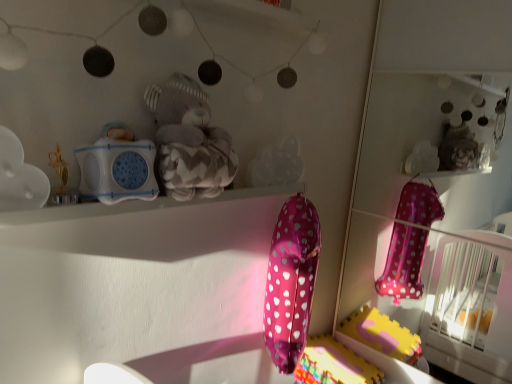
Question: From the image's perspective, is gray plush teddy bear at upper center, acting as the third toy starting from the left, below white matte cloud at upper left, which is counted as the 4th toy, starting from the right?

Choices:
 (A) no
 (B) yes

Answer: (A)

Question: Is gray plush teddy bear at upper center, acting as the third toy starting from the left, outside of white matte cloud at upper left, the 1th toy from the left?

Choices:
 (A) no
 (B) yes

Answer: (B)

Question: Can you confirm if gray plush teddy bear at upper center, acting as the third toy starting from the left, is shorter than white matte cloud at upper left, which is counted as the 4th toy, starting from the right?

Choices:
 (A) no
 (B) yes

Answer: (A)

Question: Is gray plush teddy bear at upper center, acting as the third toy starting from the left, at the left side of white matte cloud at upper left, the 1th toy from the left?

Choices:
 (A) yes
 (B) no

Answer: (B)

Question: Can you confirm if gray plush teddy bear at upper center, acting as the third toy starting from the left, is wider than white matte cloud at upper left, the 1th toy from the left?

Choices:
 (A) no
 (B) yes

Answer: (B)

Question: Considering the positions of point (272, 329) and point (309, 369), is point (272, 329) closer or farther from the camera than point (309, 369)?

Choices:
 (A) farther
 (B) closer

Answer: (B)

Question: From the image's perspective, is pink metallic balloon at center located above or below pink polka dot balloon at lower center?

Choices:
 (A) below
 (B) above

Answer: (B)

Question: From a real-world perspective, is pink metallic balloon at center above or below pink polka dot balloon at lower center?

Choices:
 (A) below
 (B) above

Answer: (B)

Question: In terms of size, does pink metallic balloon at center appear bigger or smaller than pink polka dot balloon at lower center?

Choices:
 (A) small
 (B) big

Answer: (A)

Question: From the image's perspective, relative to pink metallic balloon at center, is translucent plastic cloud at center, which is the fourth toy in left-to-right order, above or below?

Choices:
 (A) above
 (B) below

Answer: (A)

Question: From a real-world perspective, relative to pink metallic balloon at center, is translucent plastic cloud at center, which is the fourth toy in left-to-right order, vertically above or below?

Choices:
 (A) below
 (B) above

Answer: (B)

Question: Is translucent plastic cloud at center, which is the fourth toy in left-to-right order, taller or shorter than pink metallic balloon at center?

Choices:
 (A) tall
 (B) short

Answer: (B)

Question: Is point (256, 175) closer or farther from the camera than point (267, 281)?

Choices:
 (A) closer
 (B) farther

Answer: (A)

Question: Considering the positions of translucent plastic cloud at center, which appears as the first toy when viewed from the right, and white matte cloud at upper left, the 1th toy from the left, in the image, is translucent plastic cloud at center, which appears as the first toy when viewed from the right, wider or thinner than white matte cloud at upper left, the 1th toy from the left,?

Choices:
 (A) thin
 (B) wide

Answer: (A)

Question: From the image's perspective, relative to white matte cloud at upper left, the 1th toy from the left, is translucent plastic cloud at center, which appears as the first toy when viewed from the right, above or below?

Choices:
 (A) below
 (B) above

Answer: (B)